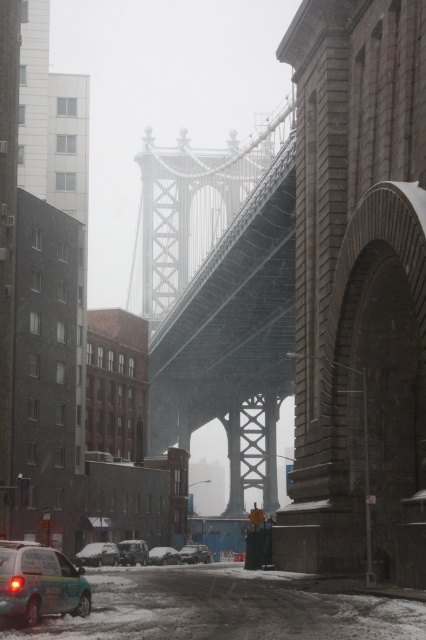
Question: Can you confirm if snow-covered cars at center is bigger than white matte van at lower left?

Choices:
 (A) no
 (B) yes

Answer: (B)

Question: Which is farther from the teal matte van at lower left?

Choices:
 (A) snow-covered sedan at center
 (B) metallic gray bridge at center
 (C) dark gray steel suspension bridge at center

Answer: (B)

Question: Which point is farther from the camera taking this photo?

Choices:
 (A) (152, 557)
 (B) (80, 552)
 (C) (344, 412)
 (D) (161, 561)

Answer: (A)

Question: Estimate the real-world distances between objects in this image. Which object is closer to the white matte van at lower left?

Choices:
 (A) matte black car at lower left
 (B) metallic gray bridge at center

Answer: (A)

Question: Can you confirm if matte black car at lower left is bigger than white matte car at center?

Choices:
 (A) yes
 (B) no

Answer: (B)

Question: Does white matte van at lower left appear over snow-covered sedan at center?

Choices:
 (A) yes
 (B) no

Answer: (A)